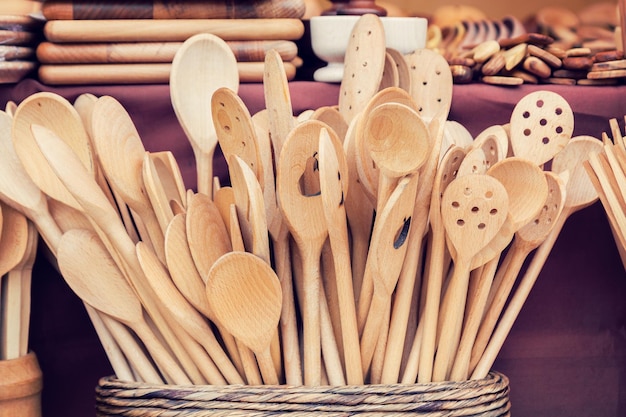
Find the location of a particular element. This screenshot has height=417, width=626. wooden plate is located at coordinates (x=9, y=73), (x=14, y=52), (x=14, y=39), (x=19, y=18).